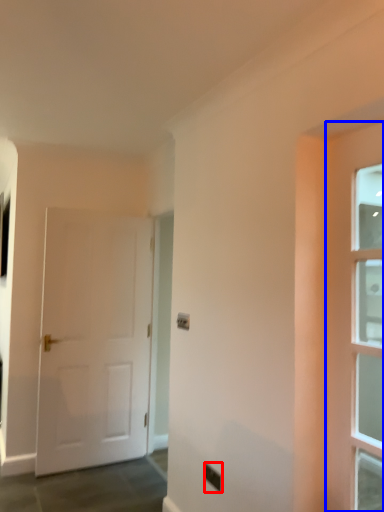
Question: Which object is closer to the camera taking this photo, electric outlet (highlighted by a red box) or door (highlighted by a blue box)?

Choices:
 (A) electric outlet
 (B) door

Answer: (B)